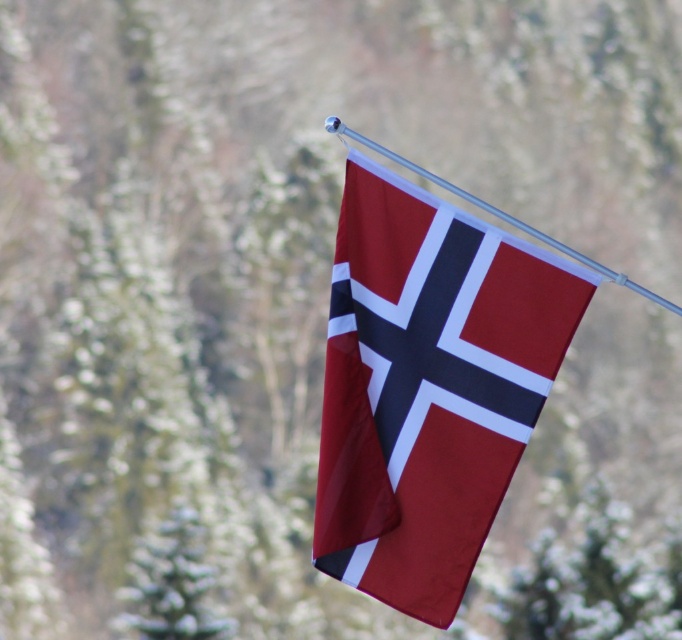
Question: Does matte fabric flag at center appear on the left side of metallic silver flag pole at upper center?

Choices:
 (A) no
 (B) yes

Answer: (B)

Question: Does matte fabric flag at center appear over metallic silver flag pole at upper center?

Choices:
 (A) yes
 (B) no

Answer: (B)

Question: Among these points, which one is farthest from the camera?

Choices:
 (A) tap(355, 138)
 (B) tap(434, 608)

Answer: (B)

Question: Which point appears farthest from the camera in this image?

Choices:
 (A) (441, 180)
 (B) (464, 262)

Answer: (A)

Question: Is matte fabric flag at center in front of metallic silver flag pole at upper center?

Choices:
 (A) yes
 (B) no

Answer: (B)